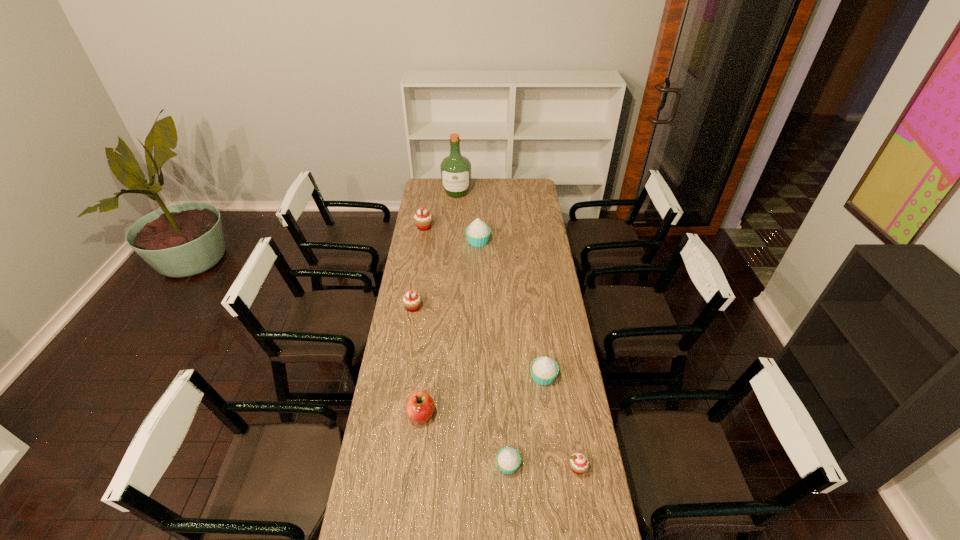
Where is `vacant region between the rightmost pink cupcake and the liquor`? vacant region between the rightmost pink cupcake and the liquor is located at coordinates (517, 330).

Locate an element on the screen. Image resolution: width=960 pixels, height=540 pixels. vacant area that lies between the smallest pink cupcake and the biggest white cupcake is located at coordinates (528, 355).

Where is `vacant space that is in between the nearest white cupcake and the sixth farthest object`? The width and height of the screenshot is (960, 540). vacant space that is in between the nearest white cupcake and the sixth farthest object is located at coordinates (465, 440).

Find the location of a particular element. free point between the fifth nearest object and the second nearest white cupcake is located at coordinates (478, 342).

This screenshot has width=960, height=540. I want to click on empty location between the fifth nearest cupcake and the fourth farthest cupcake, so click(x=511, y=309).

I want to click on vacant space in between the apple and the green liquor, so click(x=440, y=303).

Image resolution: width=960 pixels, height=540 pixels. What are the coordinates of `vacant area between the liquor and the smallest white cupcake` in the screenshot? It's located at (482, 329).

The image size is (960, 540). I want to click on object that stands as the second closest to the second biggest pink cupcake, so click(420, 406).

Locate which object is the second closest to the farthest cupcake. Please provide its 2D coordinates. Your answer should be formatted as a tuple, i.e. [(x, y)], where the tuple contains the x and y coordinates of a point satisfying the conditions above.

[(455, 169)]

This screenshot has width=960, height=540. In order to click on the closest cupcake to the smallest white cupcake in this screenshot , I will do `click(579, 463)`.